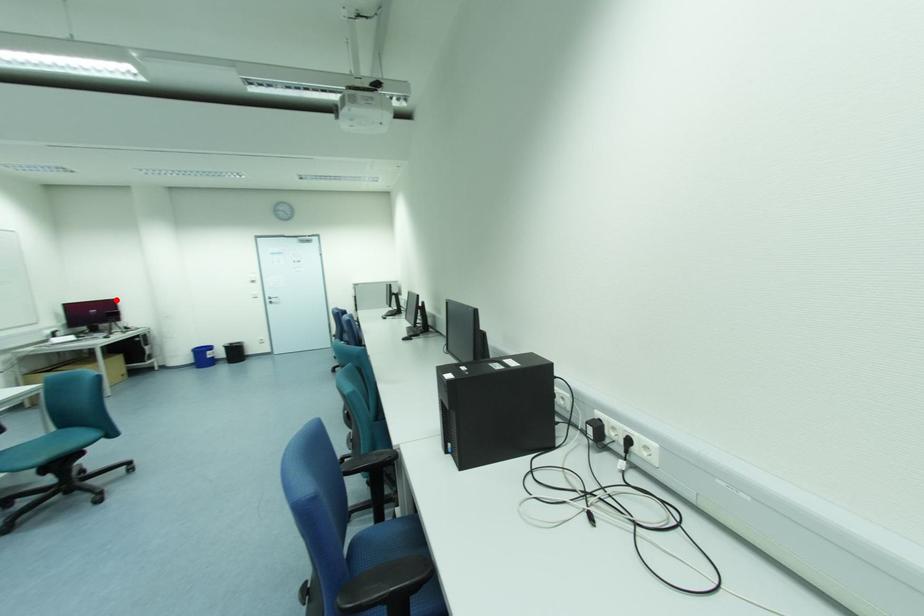
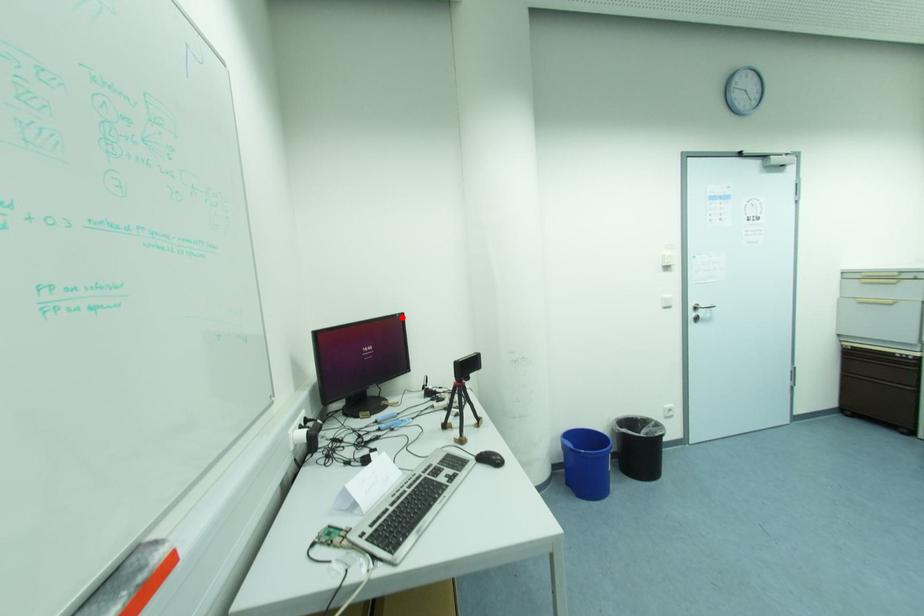
I am providing you with two images of the same scene from different viewpoints. A red point is marked on the first image and another point is marked on the second image. Are the points marked in image1 and image2 representing the same 3D position?

Yes